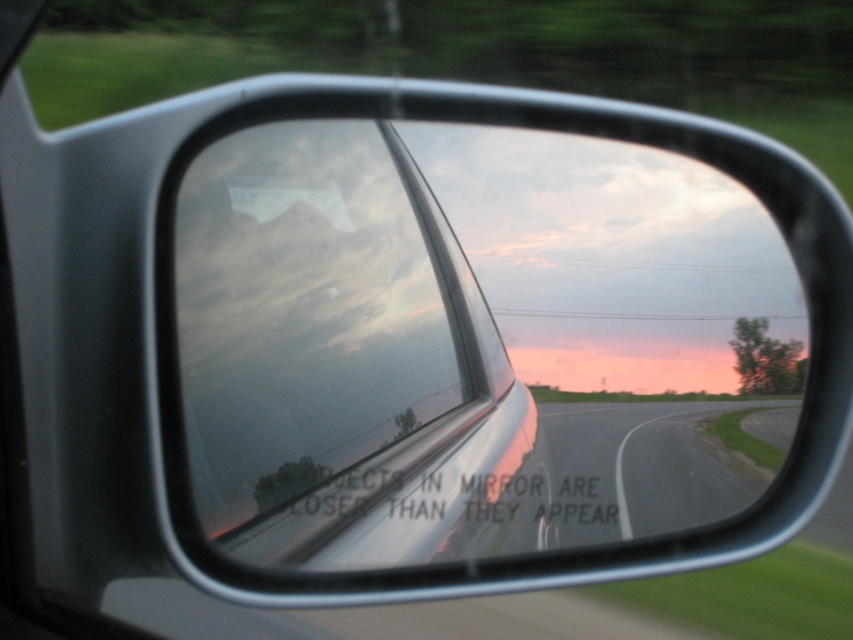
Does transparent glass car window at center have a lesser width compared to asphalt road at center?

Yes, transparent glass car window at center is thinner than asphalt road at center.

In the scene shown: Is transparent glass car window at center in front of asphalt road at center?

Yes, transparent glass car window at center is in front of asphalt road at center.

Where is `transparent glass car window at center`? transparent glass car window at center is located at coordinates (341, 360).

At what (x,y) coordinates should I click in order to perform the action: click on transparent glass car window at center. Please return your answer as a coordinate pair (x, y). This screenshot has width=853, height=640. Looking at the image, I should click on (341, 360).